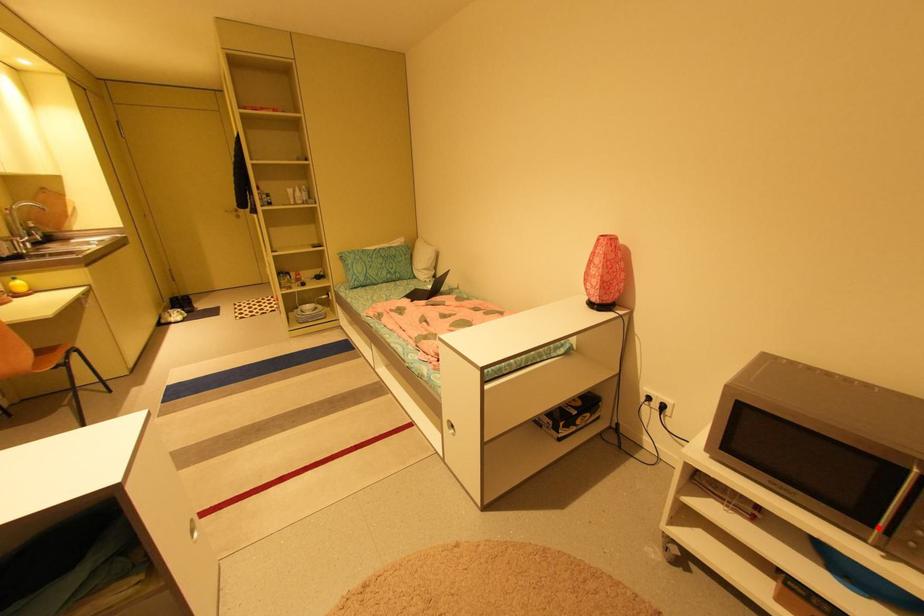
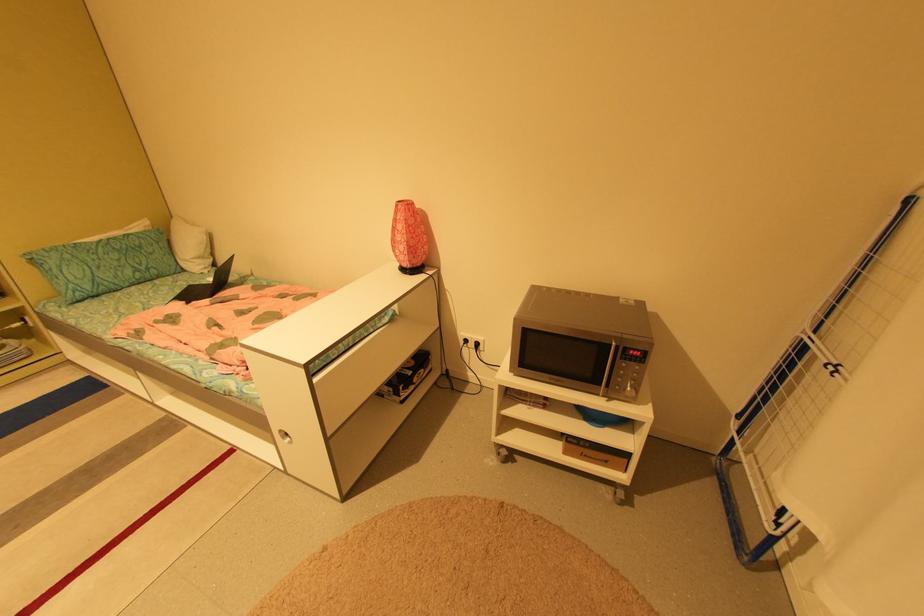
Question: I am providing you with two images of the same scene from different viewpoints. A red point is marked on the first image. Is the red point's position out of view in image 2?

Choices:
 (A) Yes
 (B) No

Answer: (B)